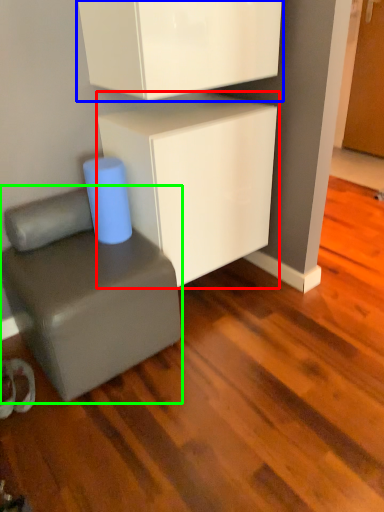
Question: Which object is positioned closest to cabinetry (highlighted by a red box)? Select from cabinetry (highlighted by a blue box) and furniture (highlighted by a green box).

Choices:
 (A) cabinetry
 (B) furniture

Answer: (A)